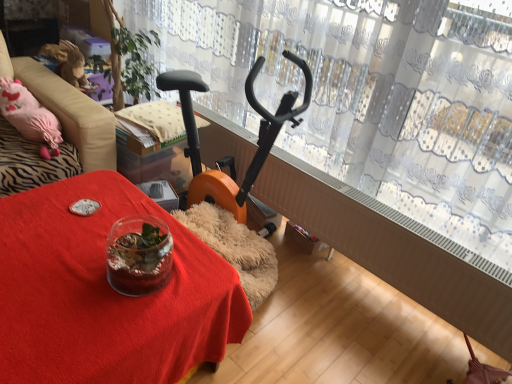
What do you see at coordinates (368, 97) in the screenshot?
I see `transparent lace curtain at upper center` at bounding box center [368, 97].

You are a GUI agent. You are given a task and a screenshot of the screen. Output one action in this format:
    pyautogui.click(x=<x>, y=<y>)
    Task: Click on the transparent lace curtain at upper center
    
    Given the screenshot: What is the action you would take?
    pyautogui.click(x=368, y=97)

Where is `translucent glass terrarium at center`? translucent glass terrarium at center is located at coordinates (105, 293).

The height and width of the screenshot is (384, 512). What do you see at coordinates (62, 131) in the screenshot? I see `velvet pink cushion at left` at bounding box center [62, 131].

The width and height of the screenshot is (512, 384). Identify the location of velvet pink cushion at left. (62, 131).

Find the location of a particular element. The width and height of the screenshot is (512, 384). transparent lace curtain at upper center is located at coordinates (368, 97).

Considering the sizes of velvet pink cushion at left and translucent glass terrarium at center in the image, is velvet pink cushion at left wider or thinner than translucent glass terrarium at center?

In the image, velvet pink cushion at left appears to be wider than translucent glass terrarium at center.

Based on the photo, how much distance is there between velvet pink cushion at left and translucent glass terrarium at center?

23.47 inches.

Locate an element on the screen. furniture that appears above the translucent glass terrarium at center (from the image's perspective) is located at coordinates (62, 131).

Considering the sizes of velvet pink cushion at left and transparent lace curtain at upper center in the image, is velvet pink cushion at left wider or thinner than transparent lace curtain at upper center?

Clearly, velvet pink cushion at left has more width compared to transparent lace curtain at upper center.

Locate an element on the screen. The width and height of the screenshot is (512, 384). curtain above the velvet pink cushion at left (from the image's perspective) is located at coordinates (368, 97).

Is velvet pink cushion at left not near transparent lace curtain at upper center?

velvet pink cushion at left is actually quite close to transparent lace curtain at upper center.

How far apart are velvet pink cushion at left and transparent lace curtain at upper center?

velvet pink cushion at left is 38.84 inches away from transparent lace curtain at upper center.

In the scene shown: How many degrees apart are the facing directions of transparent lace curtain at upper center and translucent glass terrarium at center?

They differ by 3.01 degrees in their facing directions.

Is transparent lace curtain at upper center to the left or to the right of translucent glass terrarium at center in the image?

In the image, transparent lace curtain at upper center appears on the right side of translucent glass terrarium at center.

From a real-world perspective, is transparent lace curtain at upper center located higher than translucent glass terrarium at center?

Indeed, from a real-world perspective, transparent lace curtain at upper center stands above translucent glass terrarium at center.

Which object is further away from the camera, transparent lace curtain at upper center or translucent glass terrarium at center?

transparent lace curtain at upper center is behind.

From the image's perspective, is translucent glass terrarium at center located above velvet pink cushion at left?

No, from the image's perspective, translucent glass terrarium at center is not above velvet pink cushion at left.

The width and height of the screenshot is (512, 384). Identify the location of table below the velvet pink cushion at left (from the image's perspective). (105, 293).

Is the surface of translucent glass terrarium at center in direct contact with velvet pink cushion at left?

No, translucent glass terrarium at center is not touching velvet pink cushion at left.

In terms of height, does translucent glass terrarium at center look taller or shorter compared to velvet pink cushion at left?

Clearly, translucent glass terrarium at center is shorter compared to velvet pink cushion at left.

Does point (165, 8) appear closer or farther from the camera than point (42, 79)?

Point (165, 8) appears to be farther away from the viewer than point (42, 79).

Is transparent lace curtain at upper center smaller than velvet pink cushion at left?

Actually, transparent lace curtain at upper center might be larger than velvet pink cushion at left.

Measure the distance between transparent lace curtain at upper center and velvet pink cushion at left.

transparent lace curtain at upper center and velvet pink cushion at left are 38.84 inches apart.

Is transparent lace curtain at upper center positioned beyond the bounds of velvet pink cushion at left?

Yes.

Find the location of `table that is under the transparent lace curtain at upper center (from a real-world perspective)`. table that is under the transparent lace curtain at upper center (from a real-world perspective) is located at coordinates (105, 293).

Considering the positions of objects translucent glass terrarium at center and transparent lace curtain at upper center in the image provided, who is behind, translucent glass terrarium at center or transparent lace curtain at upper center?

transparent lace curtain at upper center is further away from the camera.

Does point (129, 300) come in front of point (484, 151)?

That is True.

How many degrees apart are the facing directions of translucent glass terrarium at center and transparent lace curtain at upper center?

The angular difference between translucent glass terrarium at center and transparent lace curtain at upper center is 3.01 degrees.

Locate an element on the screen. table on the right of velvet pink cushion at left is located at coordinates (105, 293).

This screenshot has width=512, height=384. What are the coordinates of `furniture below the transparent lace curtain at upper center (from the image's perspective)` in the screenshot? It's located at (62, 131).

Looking at the image, which one is located further to transparent lace curtain at upper center, translucent glass terrarium at center or velvet pink cushion at left?

translucent glass terrarium at center.

When comparing their distances from velvet pink cushion at left, does translucent glass terrarium at center or transparent lace curtain at upper center seem further?

Based on the image, transparent lace curtain at upper center appears to be further to velvet pink cushion at left.

Which object lies further to the anchor point velvet pink cushion at left, transparent lace curtain at upper center or translucent glass terrarium at center?

Based on the image, transparent lace curtain at upper center appears to be further to velvet pink cushion at left.

When comparing their distances from transparent lace curtain at upper center, does velvet pink cushion at left or translucent glass terrarium at center seem closer?

velvet pink cushion at left lies closer to transparent lace curtain at upper center than the other object.

When comparing their distances from translucent glass terrarium at center, does velvet pink cushion at left or transparent lace curtain at upper center seem closer?

velvet pink cushion at left.

Estimate the real-world distances between objects in this image. Which object is further from translucent glass terrarium at center, transparent lace curtain at upper center or velvet pink cushion at left?

Among the two, transparent lace curtain at upper center is located further to translucent glass terrarium at center.

The image size is (512, 384). I want to click on table situated between velvet pink cushion at left and transparent lace curtain at upper center from left to right, so click(x=105, y=293).